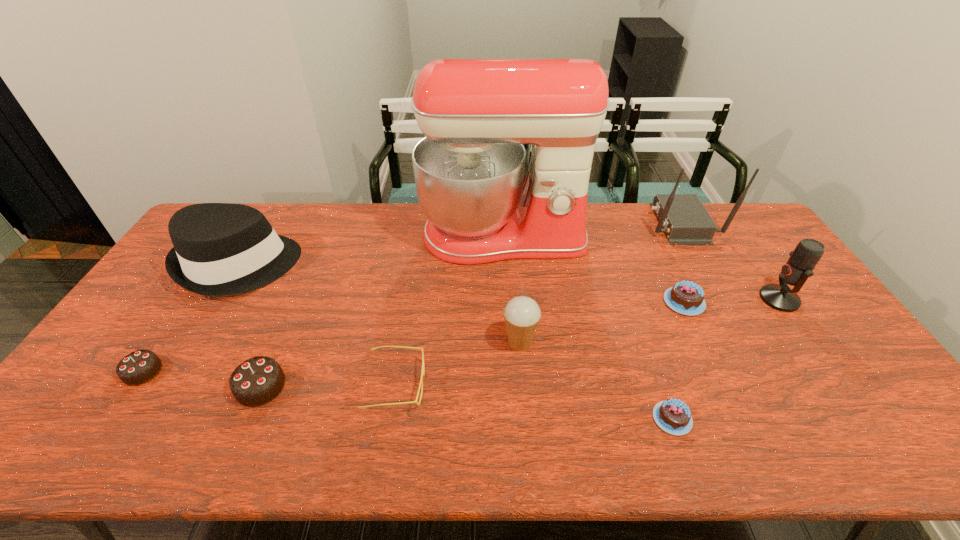
Locate an element on the screen. object identified as the eighth closest to the beige spectacles is located at coordinates (684, 219).

At what (x,y) coordinates should I click in order to perform the action: click on object that stands as the sixth closest to the fedora. Please return your answer as a coordinate pair (x, y). Looking at the image, I should click on (673, 416).

Identify which chocolate cake is located as the nearest to the third chocolate cake from right to left. Please provide its 2D coordinates. Your answer should be formatted as a tuple, i.e. [(x, y)], where the tuple contains the x and y coordinates of a point satisfying the conditions above.

[(138, 367)]

The image size is (960, 540). I want to click on the second closest chocolate cake to the smaller pink chocolate cake, so click(255, 382).

Find the location of a particular element. vacant space that satisfies the following two spatial constraints: 1. on the back of the second tallest object to connect cables; 2. on the front-facing side of the tallest object is located at coordinates (687, 237).

This screenshot has width=960, height=540. I want to click on vacant position in the image that satisfies the following two spatial constraints: 1. on the front side of the left chocolate chocolate cake; 2. on the left side of the tallest chocolate cake, so click(x=133, y=387).

Find the location of `vacant space that satisfies the following two spatial constraints: 1. on the side of the microphone with the red ring; 2. on the front side of the icecream`. vacant space that satisfies the following two spatial constraints: 1. on the side of the microphone with the red ring; 2. on the front side of the icecream is located at coordinates [809, 343].

Find the location of a particular element. free space that satisfies the following two spatial constraints: 1. on the front side of the sixth shortest object; 2. on the right side of the smaller pink chocolate cake is located at coordinates (526, 418).